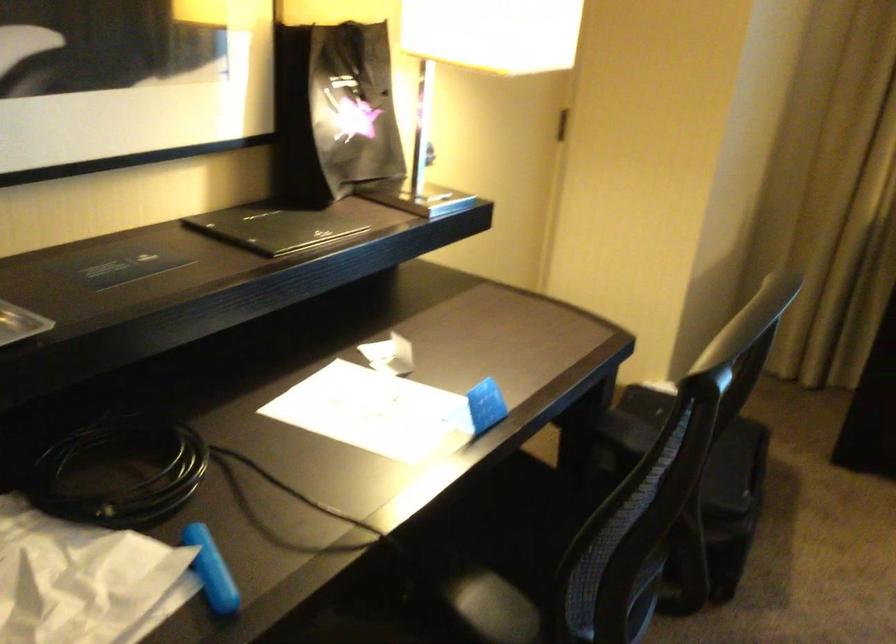
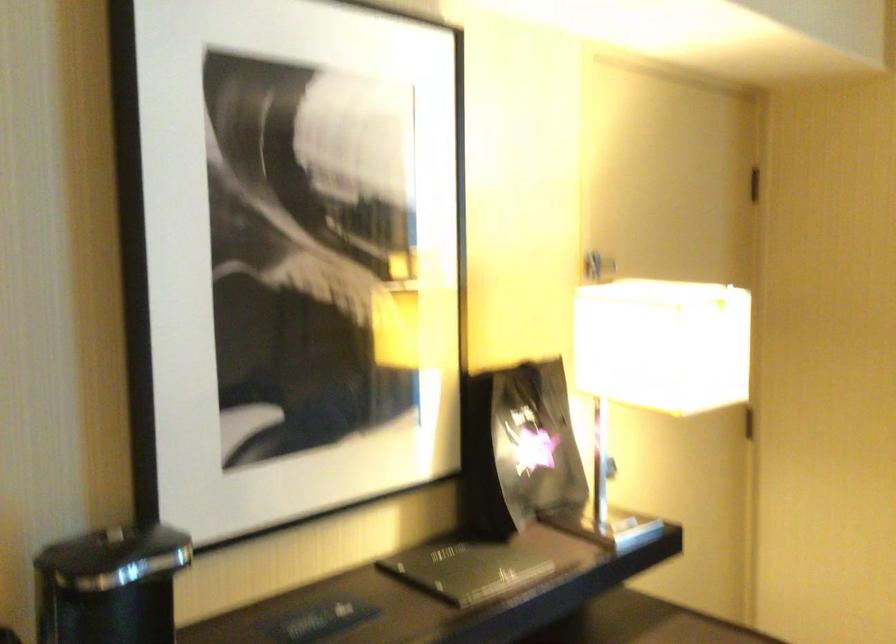
Question: How did the camera likely rotate?

Choices:
 (A) Left
 (B) Right
 (C) Up
 (D) Down

Answer: (C)